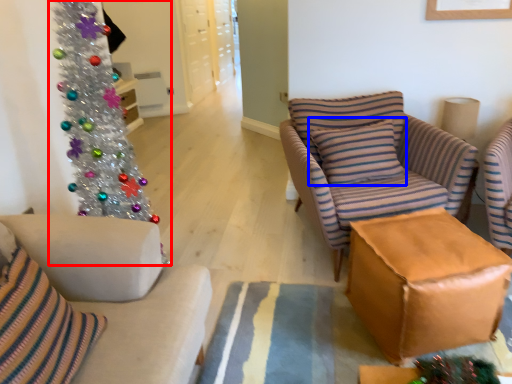
Question: Which of the following is the closest to the observer, christmas tree (highlighted by a red box) or pillow (highlighted by a blue box)?

Choices:
 (A) christmas tree
 (B) pillow

Answer: (A)